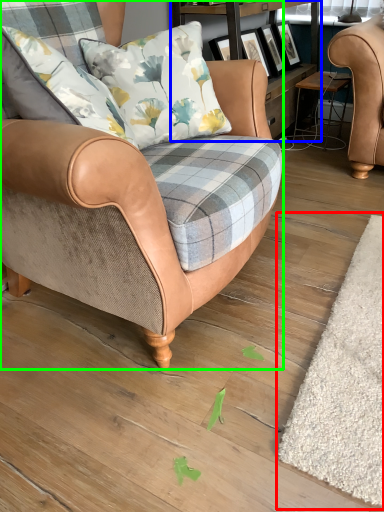
Question: Which object is positioned closest to mat (highlighted by a red box)? Select from shelf (highlighted by a blue box) and chair (highlighted by a green box).

Choices:
 (A) shelf
 (B) chair

Answer: (B)